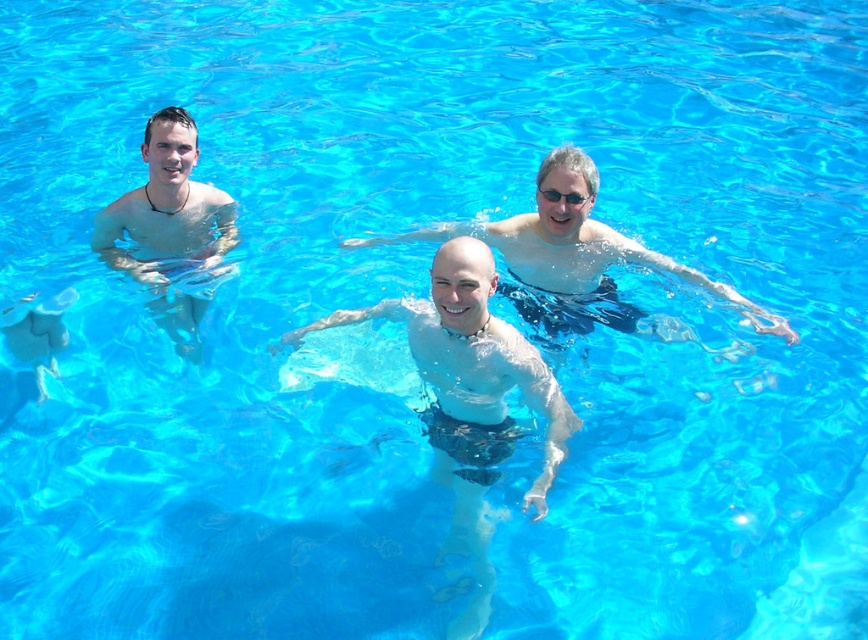
Does matte black swim trunks at center appear under transparent plastic goggles at center?

Correct, matte black swim trunks at center is located below transparent plastic goggles at center.

Can you confirm if matte black swim trunks at center is thinner than transparent plastic goggles at center?

No.

You are a GUI agent. You are given a task and a screenshot of the screen. Output one action in this format:
    pyautogui.click(x=<x>, y=<y>)
    Task: Click on the matte black swim trunks at center
    
    Given the screenshot: What is the action you would take?
    pyautogui.click(x=573, y=257)

Find the location of a particular element. Image resolution: width=868 pixels, height=640 pixels. matte black swim trunks at left is located at coordinates (169, 227).

Is matte black swim trunks at left smaller than transparent plastic goggles at center?

No, matte black swim trunks at left is not smaller than transparent plastic goggles at center.

The width and height of the screenshot is (868, 640). Describe the element at coordinates (169, 227) in the screenshot. I see `matte black swim trunks at left` at that location.

Find the location of a particular element. The image size is (868, 640). matte black swim trunks at left is located at coordinates (169, 227).

Is matte black swim trunks at center behind matte black swim trunks at left?

No, matte black swim trunks at center is in front of matte black swim trunks at left.

Describe the element at coordinates (573, 257) in the screenshot. I see `matte black swim trunks at center` at that location.

You are a GUI agent. You are given a task and a screenshot of the screen. Output one action in this format:
    pyautogui.click(x=<x>, y=<y>)
    Task: Click on the matte black swim trunks at center
    This screenshot has height=640, width=868.
    Given the screenshot: What is the action you would take?
    point(573,257)